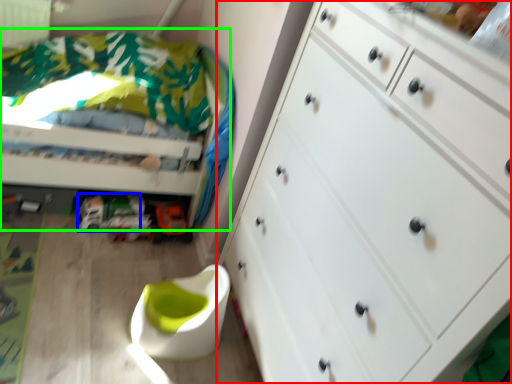
Question: Estimate the real-world distances between objects in this image. Which object is farther from chest of drawers (highlighted by a red box), toy car (highlighted by a blue box) or bed (highlighted by a green box)?

Choices:
 (A) toy car
 (B) bed

Answer: (A)